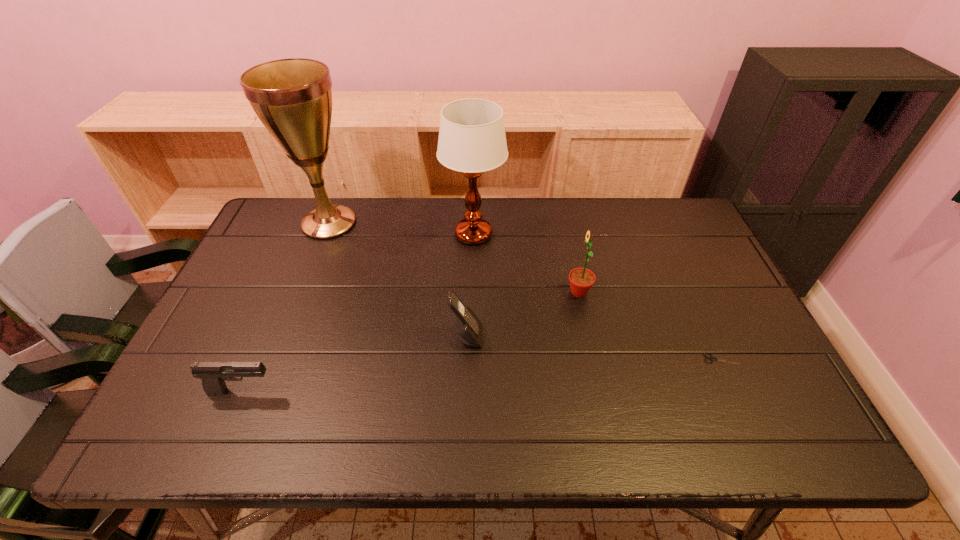
I want to click on trophy cup, so click(292, 97).

Locate an element on the screen. table lamp is located at coordinates (472, 140).

Locate an element on the screen. Image resolution: width=960 pixels, height=540 pixels. the third tallest object is located at coordinates (581, 280).

At what (x,y) coordinates should I click in order to perform the action: click on the second object from right to left. Please return your answer as a coordinate pair (x, y). The image size is (960, 540). Looking at the image, I should click on (581, 280).

Locate an element on the screen. This screenshot has width=960, height=540. the fourth tallest object is located at coordinates (468, 326).

The width and height of the screenshot is (960, 540). What are the coordinates of `cellular telephone` in the screenshot? It's located at (468, 326).

Where is `the nearest object`? the nearest object is located at coordinates [x=213, y=374].

Where is `pistol`? This screenshot has width=960, height=540. pistol is located at coordinates pyautogui.click(x=213, y=374).

The image size is (960, 540). What are the coordinates of `the fifth farthest object` in the screenshot? It's located at pos(711,358).

Locate an element on the screen. the shortest object is located at coordinates (711, 358).